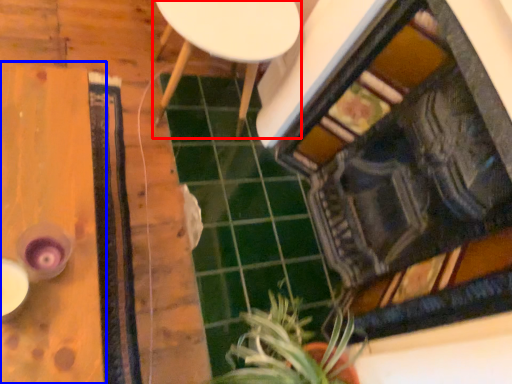
Question: Which point is closer to the camera, furniture (highlighted by a red box) or table (highlighted by a blue box)?

Choices:
 (A) furniture
 (B) table

Answer: (B)